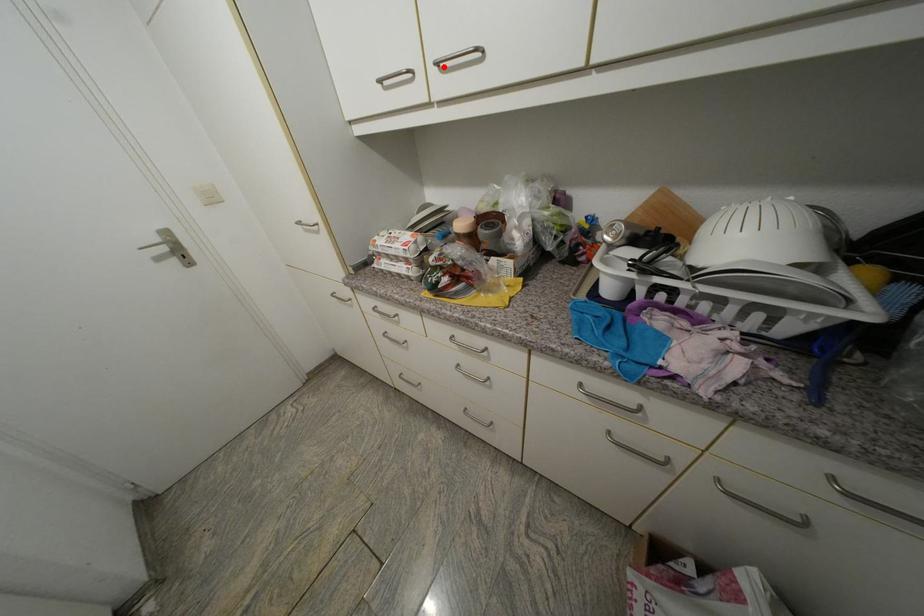
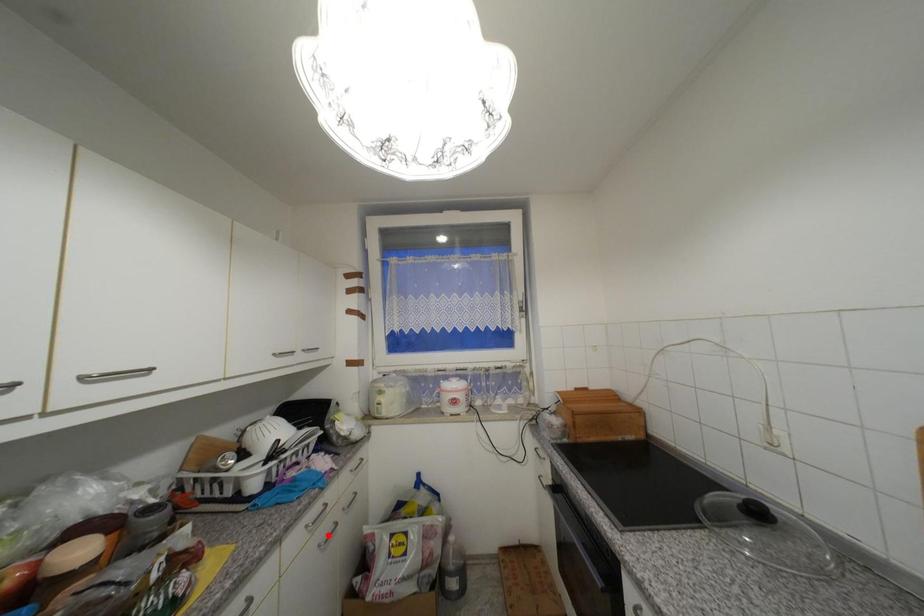
I am providing you with two images of the same scene from different viewpoints. A red point is marked on the first image and another point is marked on the second image. Is the red point in image1 aligned with the point shown in image2?

No